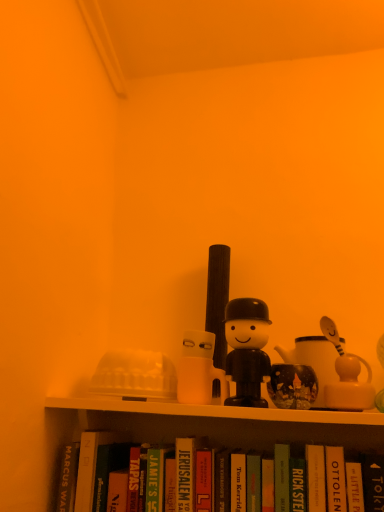
Question: Considering the positions of hardcover book at center, arranged as the sixth paperback book when viewed from the right, and white matte mug at center, arranged as the 1th toy when viewed from the left, in the image, is hardcover book at center, arranged as the sixth paperback book when viewed from the right, taller or shorter than white matte mug at center, arranged as the 1th toy when viewed from the left,?

Choices:
 (A) tall
 (B) short

Answer: (A)

Question: Is hardcover book at center, arranged as the sixth paperback book when viewed from the right, bigger or smaller than white matte mug at center, arranged as the 1th toy when viewed from the left?

Choices:
 (A) big
 (B) small

Answer: (A)

Question: Based on their relative distances, which object is nearer to the hardcover book at center, the 3th paperback book positioned from the right?

Choices:
 (A) hardcover book at center, arranged as the sixth paperback book when viewed from the right
 (B) hardcover book at lower right, which appears as the sixth paperback book when viewed from the left
 (C) green matte book at lower center, the first paperback book from the left
 (D) white glossy teapot at right, the 4th toy when ordered from left to right
 (E) hardcover book at center, placed as the 1th paperback book when sorted from right to left

Answer: (B)

Question: Which of these objects is positioned farthest from the white matte mug at center, the fourth toy in the right-to-left sequence?

Choices:
 (A) white glossy teapot at right, the 4th toy when ordered from left to right
 (B) green matte paperback book at center, placed as the fourth paperback book when sorted from left to right
 (C) black plastic toy at center, which is the second toy from left to right
 (D) hardcover book at center, acting as the fifth paperback book starting from the right
 (E) hardcover book at center, the 5th paperback book viewed from the left

Answer: (A)